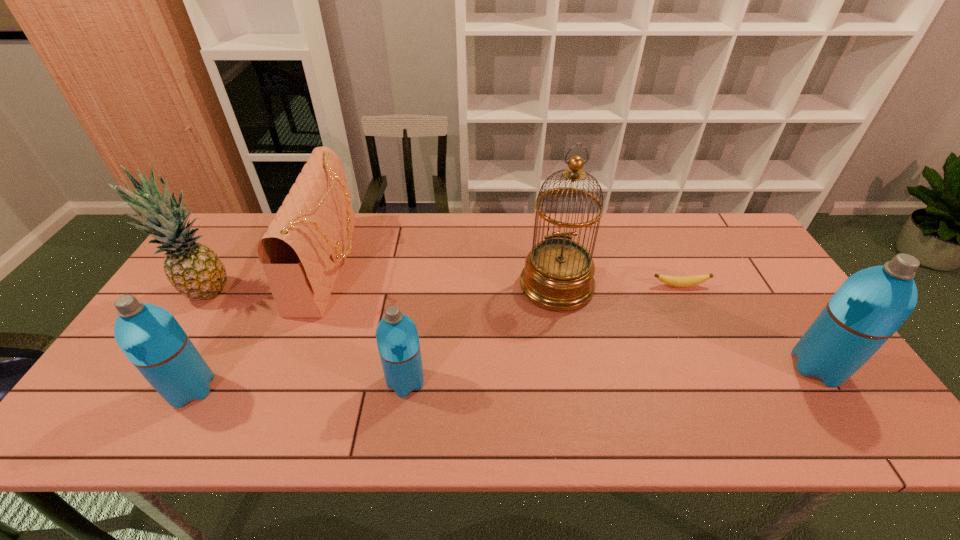
Where is `vacant space that's between the third object from left to right and the shortest object`? The width and height of the screenshot is (960, 540). vacant space that's between the third object from left to right and the shortest object is located at coordinates (505, 275).

Locate an element on the screen. Image resolution: width=960 pixels, height=540 pixels. empty space between the handbag and the fourth object from left to right is located at coordinates (368, 323).

What are the coordinates of `free point between the banana and the pineapple` in the screenshot? It's located at (443, 289).

Where is `free space between the rightmost object and the second object from right to left`? The width and height of the screenshot is (960, 540). free space between the rightmost object and the second object from right to left is located at coordinates (749, 327).

Where is `free space between the birdcage and the handbag`? This screenshot has height=540, width=960. free space between the birdcage and the handbag is located at coordinates (444, 275).

Find the location of a particular element. This screenshot has height=540, width=960. free space between the second thermos bottle from right to left and the fifth object from left to right is located at coordinates (481, 334).

Image resolution: width=960 pixels, height=540 pixels. In order to click on object that can be found as the second closest to the birdcage in this screenshot , I will do `click(397, 338)`.

You are a GUI agent. You are given a task and a screenshot of the screen. Output one action in this format:
    pyautogui.click(x=<x>, y=<y>)
    Task: Click on the object that is the second closest one to the second object from right to left
    The width and height of the screenshot is (960, 540).
    Given the screenshot: What is the action you would take?
    pyautogui.click(x=870, y=306)

Locate an element on the screen. thermos bottle that stands as the third closest to the handbag is located at coordinates (870, 306).

Choose which thermos bottle is the third nearest neighbor to the handbag. Please provide its 2D coordinates. Your answer should be formatted as a tuple, i.e. [(x, y)], where the tuple contains the x and y coordinates of a point satisfying the conditions above.

[(870, 306)]